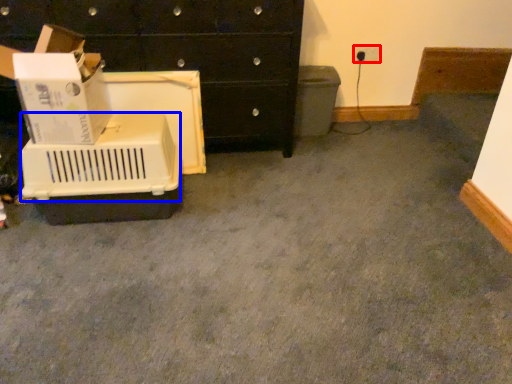
Question: Which of the following is the closest to the observer, electric outlet (highlighted by a red box) or basket (highlighted by a blue box)?

Choices:
 (A) electric outlet
 (B) basket

Answer: (B)